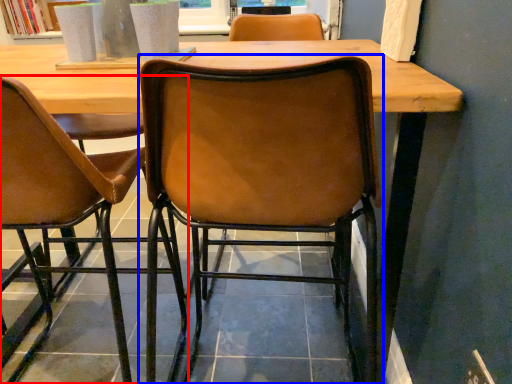
Question: Among these objects, which one is farthest to the camera, chair (highlighted by a red box) or chair (highlighted by a blue box)?

Choices:
 (A) chair
 (B) chair

Answer: (A)